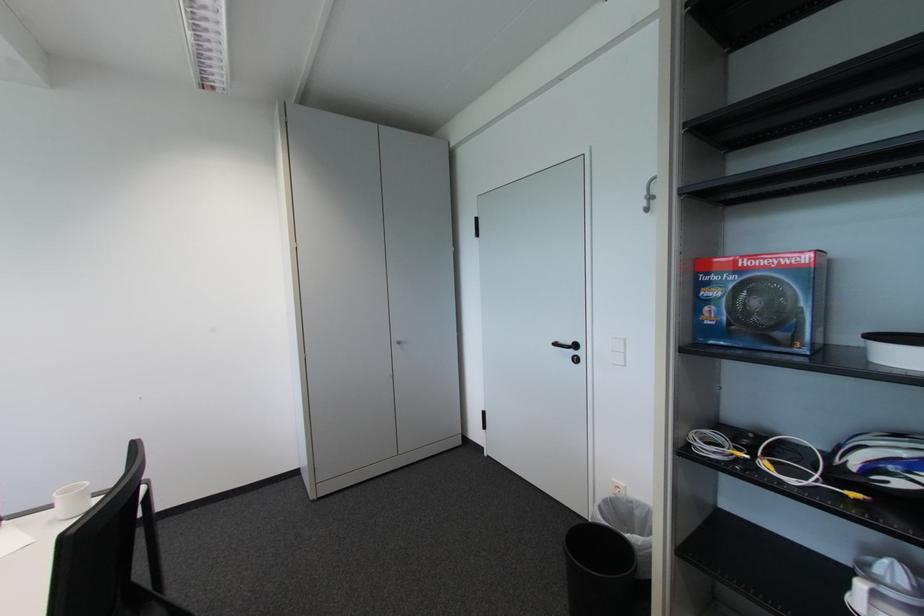
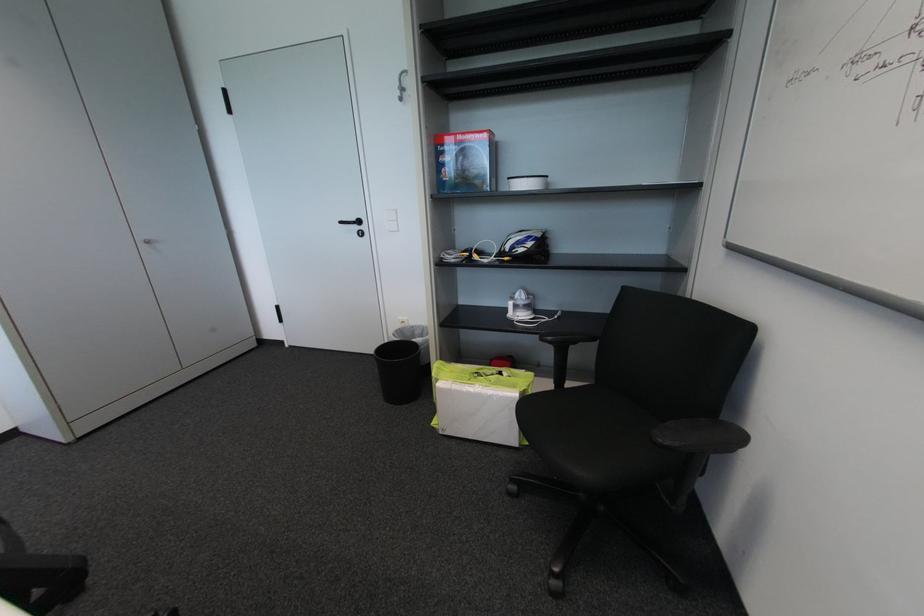
Find the pixel in the second image that matches the point at 403,347 in the first image.

(151, 246)